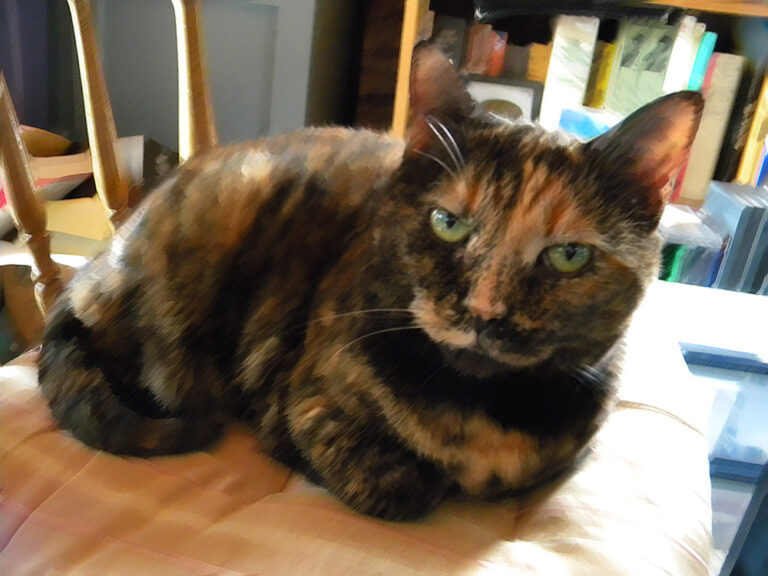
Identify the location of cushion. (239, 502).